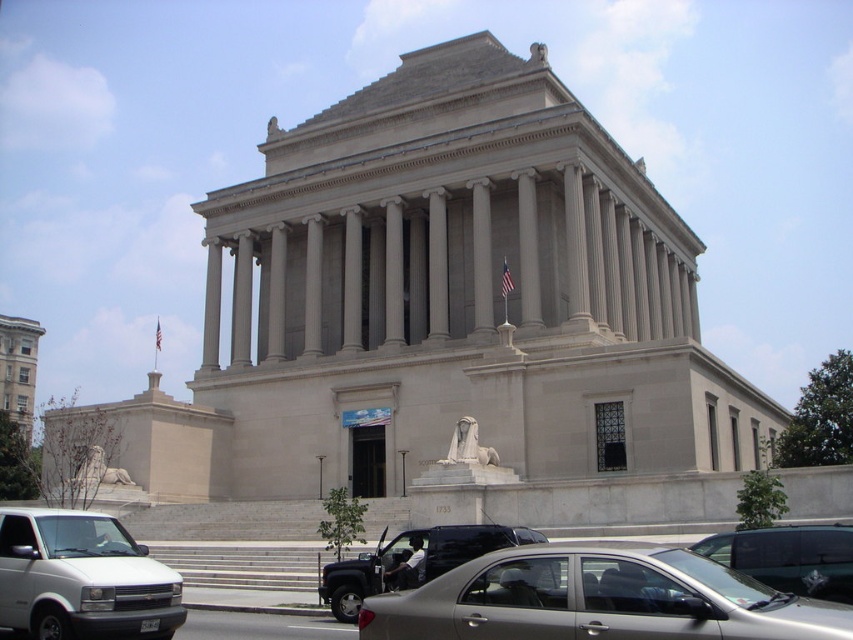
Is point (749, 589) more distant than point (109, 468)?

No, (749, 589) is closer to viewer.

The image size is (853, 640). What do you see at coordinates (598, 598) in the screenshot?
I see `silver metallic sedan at center` at bounding box center [598, 598].

Where is `silver metallic sedan at center`? The image size is (853, 640). silver metallic sedan at center is located at coordinates (598, 598).

Does silver metallic sedan at center come in front of metallic black truck at center?

Yes, it is.

Does silver metallic sedan at center have a greater height compared to metallic black truck at center?

Correct, silver metallic sedan at center is much taller as metallic black truck at center.

Does point (447, 609) come farther from viewer compared to point (445, 529)?

No, (447, 609) is closer to viewer.

The width and height of the screenshot is (853, 640). Identify the location of silver metallic sedan at center. (598, 598).

Looking at this image, does white marble sphinx at center have a greater height compared to gray stone lion at center?

Indeed, white marble sphinx at center has a greater height compared to gray stone lion at center.

Is point (477, 426) more distant than point (90, 484)?

No, it is not.

Which is in front, point (473, 428) or point (91, 454)?

Point (473, 428) is in front.

Find the location of a particular element. white marble sphinx at center is located at coordinates (468, 445).